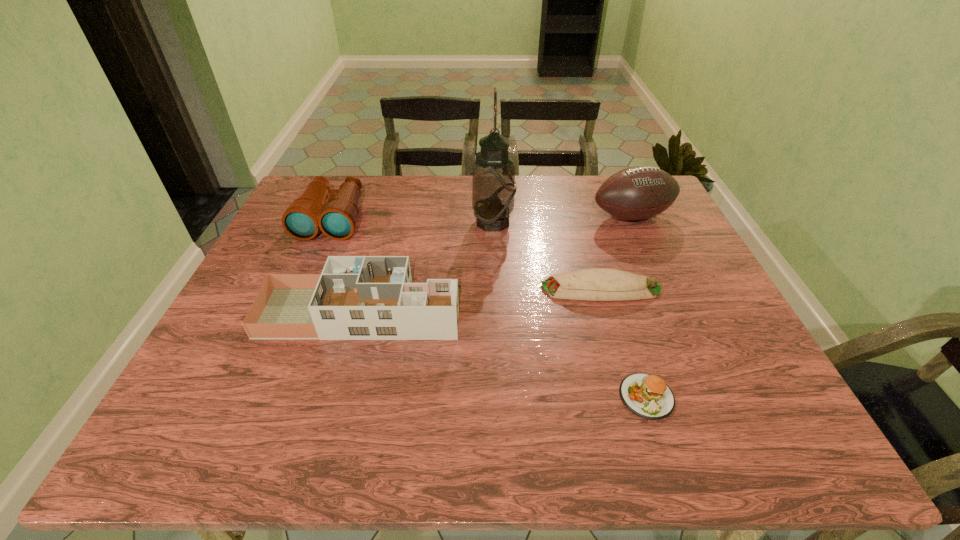
Locate an element on the screen. vacant area situated 0.170m at the front door of the dollhouse is located at coordinates (531, 313).

This screenshot has height=540, width=960. I want to click on vacant region located at the bitten end of the burrito, so click(x=509, y=289).

The width and height of the screenshot is (960, 540). Find the location of `vacant point located at the bitten end of the burrito`. vacant point located at the bitten end of the burrito is located at coordinates (486, 289).

Locate an element on the screen. This screenshot has width=960, height=540. free region located 0.230m at the bitten end of the burrito is located at coordinates (449, 289).

This screenshot has width=960, height=540. I want to click on free spot located on the left of the patty, so click(x=429, y=396).

This screenshot has width=960, height=540. I want to click on oil lamp located at the far edge, so click(x=493, y=182).

The width and height of the screenshot is (960, 540). Identify the location of football (American) that is at the far edge. (640, 192).

The height and width of the screenshot is (540, 960). I want to click on binoculars that is at the far edge, so click(x=337, y=219).

Identify the location of object positioned at the near edge. The image size is (960, 540). (648, 396).

The image size is (960, 540). In order to click on binoculars located at the left edge in this screenshot , I will do `click(337, 219)`.